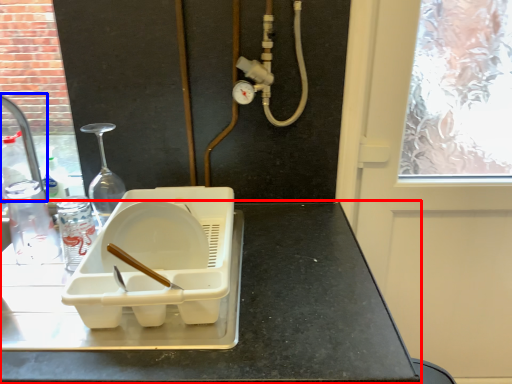
Question: Which object is further to the camera taking this photo, countertop (highlighted by a red box) or faucet (highlighted by a blue box)?

Choices:
 (A) countertop
 (B) faucet

Answer: (B)